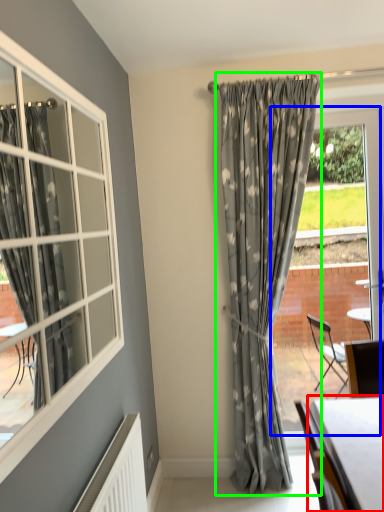
Question: Which object is positioned closest to table (highlighted by a red box)? Select from window frame (highlighted by a blue box) and curtain (highlighted by a green box).

Choices:
 (A) window frame
 (B) curtain

Answer: (B)